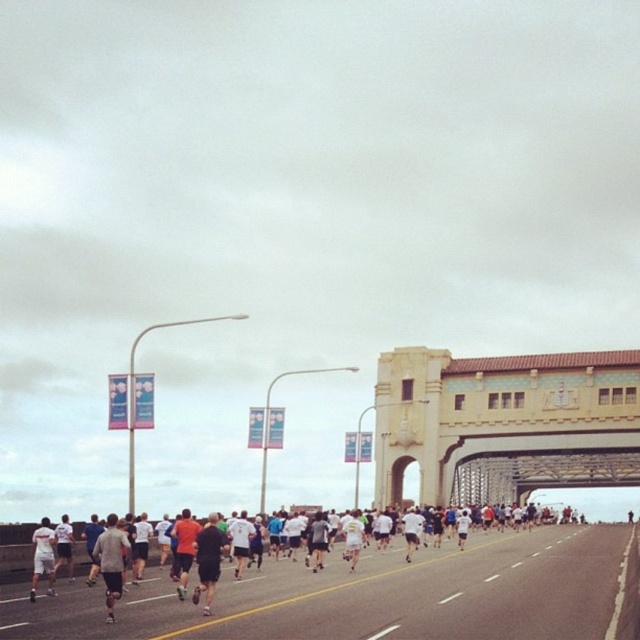
Is white matte shorts at lower left to the left of white matte shorts at center from the viewer's perspective?

Correct, you'll find white matte shorts at lower left to the left of white matte shorts at center.

Who is taller, white matte shorts at lower left or white matte shorts at center?

Standing taller between the two is white matte shorts at lower left.

Who is more distant from viewer, (33, 588) or (72, 573)?

Positioned behind is point (72, 573).

The image size is (640, 640). I want to click on white matte shorts at lower left, so click(42, 557).

Is black asphalt highway at center shorter than yellow concrete bridge at center?

Yes.

Measure the distance between point (225, 600) and camera.

Point (225, 600) and camera are 70.80 meters apart from each other.

Who is more distant from viewer, (428,557) or (554,365)?

The point (554,365) is more distant.

I want to click on black asphalt highway at center, so click(x=371, y=596).

Can you confirm if yellow concrete bridge at center is taller than dark gray athletic wear at center?

No, yellow concrete bridge at center is not taller than dark gray athletic wear at center.

This screenshot has width=640, height=640. What do you see at coordinates (504, 422) in the screenshot?
I see `yellow concrete bridge at center` at bounding box center [504, 422].

Find the location of a particular element. This screenshot has height=640, width=640. yellow concrete bridge at center is located at coordinates (504, 422).